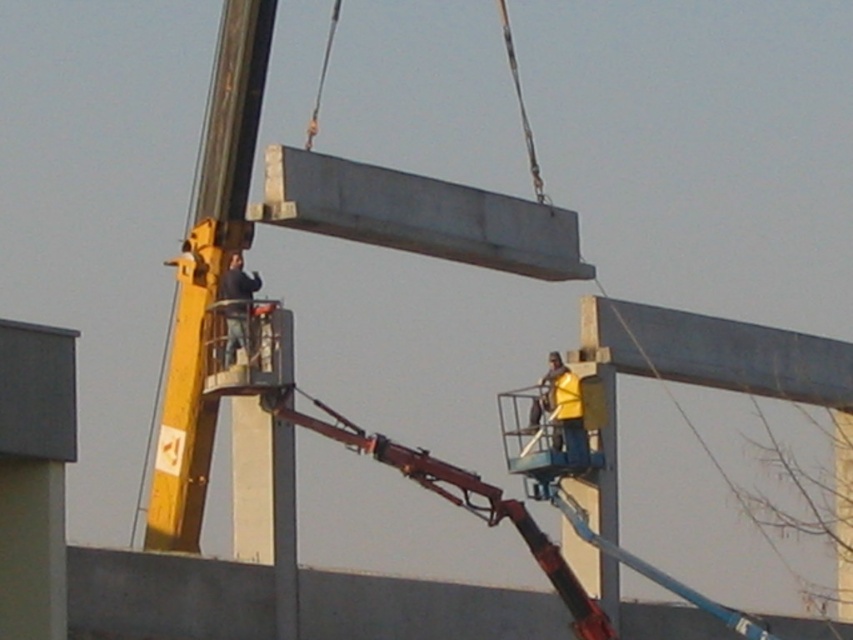
Is point (573, 428) positioned after point (231, 280)?

Yes, it is.

Is yellow fabric construction worker at center bigger than dark blue jeans at upper center?

Indeed, yellow fabric construction worker at center has a larger size compared to dark blue jeans at upper center.

Which is in front, point (567, 371) or point (248, 348)?

Point (248, 348) is more forward.

Where is `yellow fabric construction worker at center`? This screenshot has height=640, width=853. yellow fabric construction worker at center is located at coordinates (560, 406).

Does metallic gray beam at upper right have a greater height compared to dark blue jeans at upper center?

Correct, metallic gray beam at upper right is much taller as dark blue jeans at upper center.

Who is more distant from viewer, (820, 344) or (235, 349)?

Positioned behind is point (820, 344).

At what (x,y) coordinates should I click in order to perform the action: click on metallic gray beam at upper right. Please return your answer as a coordinate pair (x, y). The height and width of the screenshot is (640, 853). Looking at the image, I should click on (715, 353).

What do you see at coordinates (715, 353) in the screenshot? This screenshot has width=853, height=640. I see `metallic gray beam at upper right` at bounding box center [715, 353].

Does metallic gray beam at upper right appear on the right side of yellow fabric construction worker at center?

Correct, you'll find metallic gray beam at upper right to the right of yellow fabric construction worker at center.

Between point (717, 349) and point (553, 355), which one is positioned behind?

The point (717, 349) is behind.

Where is `metallic gray beam at upper right`? The width and height of the screenshot is (853, 640). metallic gray beam at upper right is located at coordinates (715, 353).